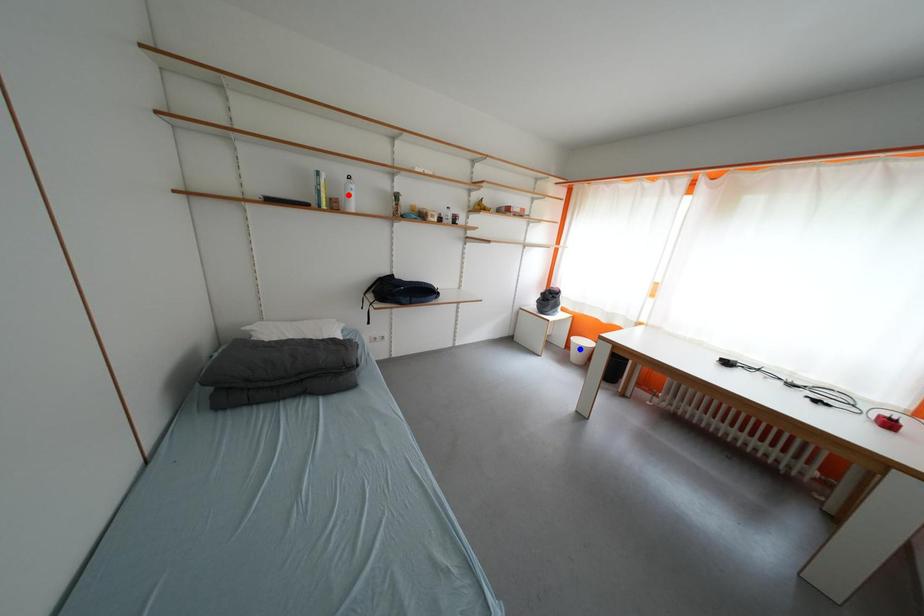
Question: Which of the two points in the image is closer to the camera?

Choices:
 (A) Blue point is closer.
 (B) Red point is closer.

Answer: (B)